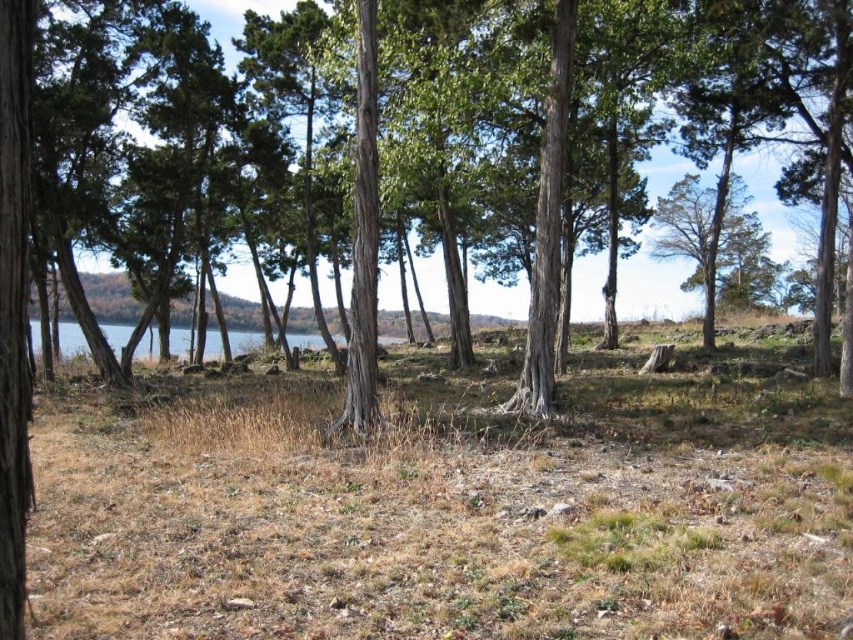
You are a hiker trying to cross the clearing in the scene. You need to step over the brown dry grass at center and the smooth bark tree at center. Which one will require you to jump higher?

The smooth bark tree at center requires a higher jump since it is taller than the brown dry grass at center.

You are standing at the point labeled as point [444,509] in the center of the image. Looking around, you notice the brown dry grass surrounding you. What is the immediate terrain you are standing on?

The point [444,509] is on brown dry grass at center.